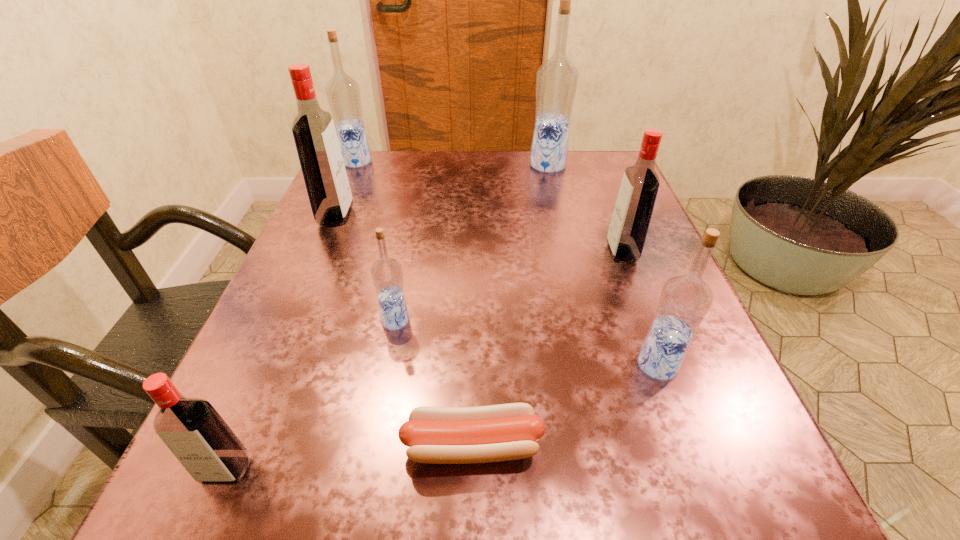
Locate an element on the screen. vacant point at the near edge is located at coordinates (584, 484).

This screenshot has width=960, height=540. Find the location of `vacant region at the left edge`. vacant region at the left edge is located at coordinates (294, 384).

Identify the location of vacant space at the right edge of the desktop. (658, 259).

At what (x,y) coordinates should I click in order to perform the action: click on free space at the far left corner of the desktop. Please return your answer as a coordinate pair (x, y). The width and height of the screenshot is (960, 540). Looking at the image, I should click on (384, 195).

Identify the location of free location at the far right corner. The height and width of the screenshot is (540, 960). (574, 171).

Locate an element on the screen. This screenshot has width=960, height=540. free space that is in between the fourth object from left to right and the smallest red vodka is located at coordinates (311, 395).

Identify the location of vacant space that's between the nearest vodka and the fourth farthest object. (423, 362).

Locate an element on the screen. This screenshot has height=540, width=960. free point between the leftmost blue vodka and the nearest vodka is located at coordinates (292, 316).

I want to click on vacant region between the second biggest red vodka and the tallest object, so click(585, 210).

This screenshot has width=960, height=540. I want to click on blank region between the second biggest blue vodka and the nearest blue vodka, so click(x=507, y=264).